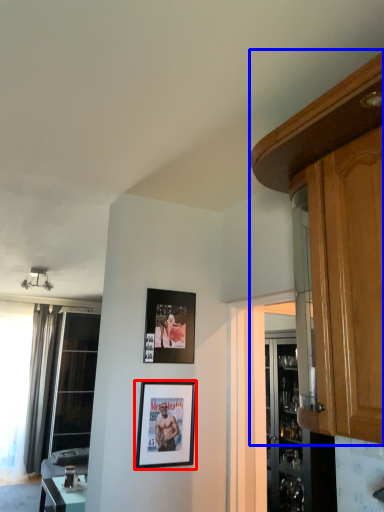
Question: Which point is closer to the camera, picture frame (highlighted by a red box) or cabinetry (highlighted by a blue box)?

Choices:
 (A) picture frame
 (B) cabinetry

Answer: (B)